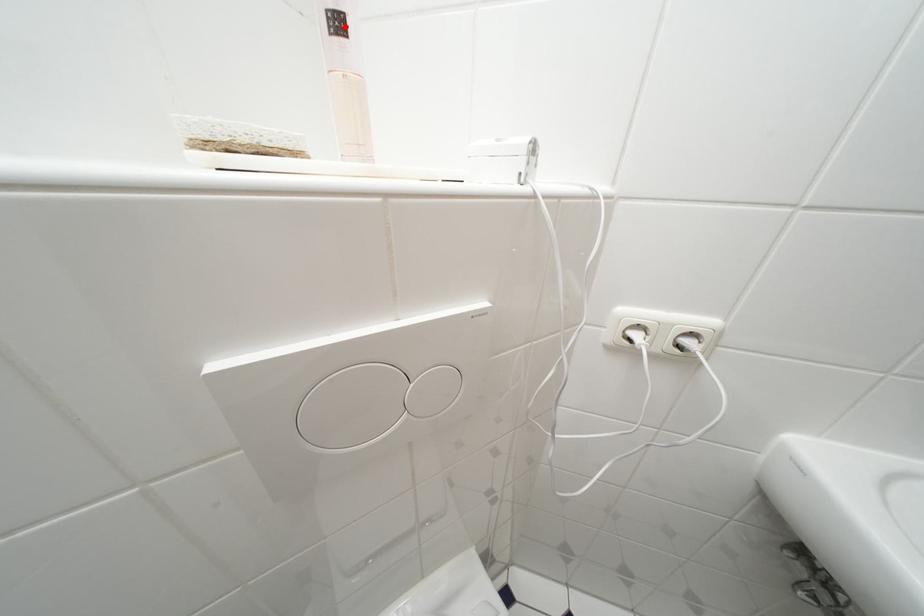
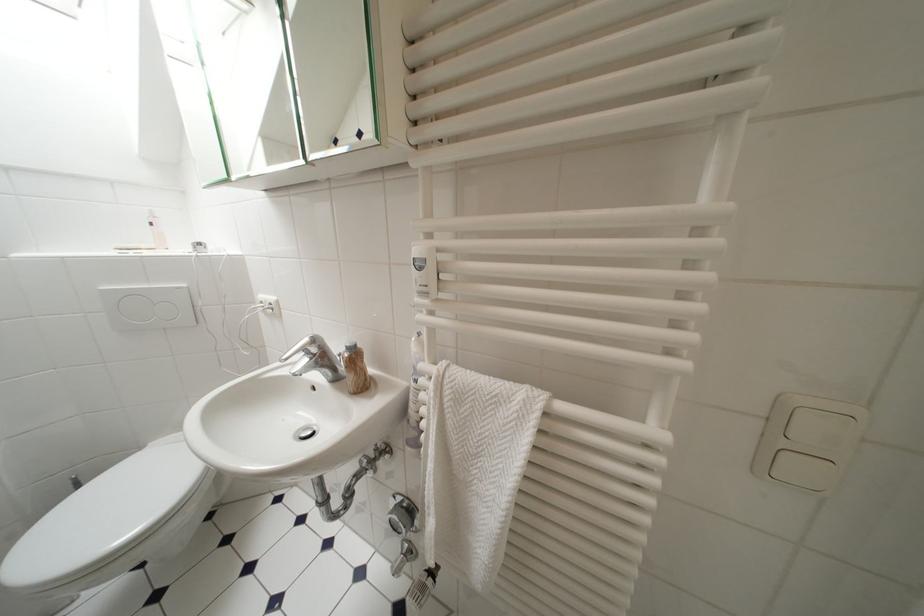
Find the pixel in the second image that matches the highlighted location in the first image.

(159, 227)